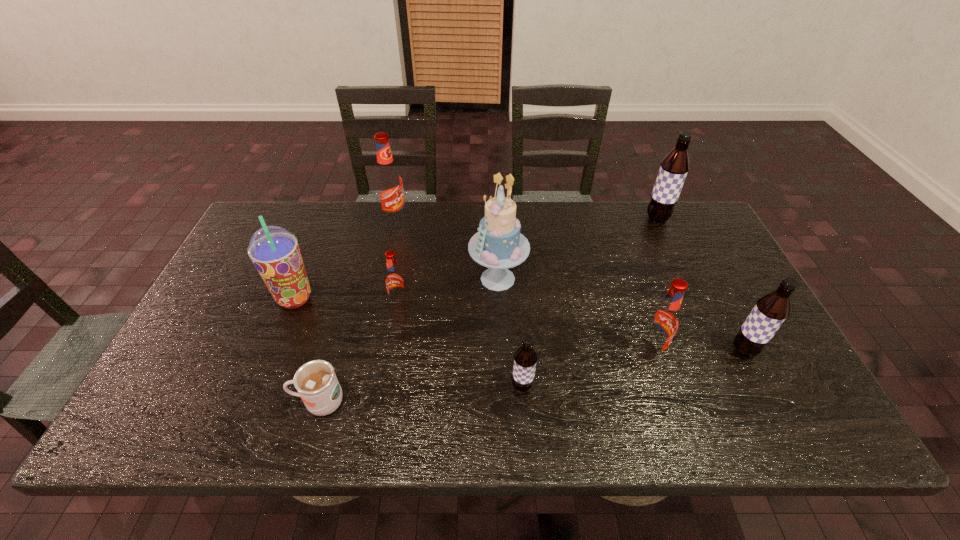
Image resolution: width=960 pixels, height=540 pixels. In order to click on free location located 0.150m on the right of the second farthest red root beer in this screenshot , I will do `click(464, 302)`.

I want to click on vacant space located 0.230m on the back of the nearest brown root beer, so click(x=516, y=304).

The image size is (960, 540). I want to click on vacant space situated 0.050m on the side with the handle of the cup, so click(x=269, y=402).

You are a GUI agent. You are given a task and a screenshot of the screen. Output one action in this format:
    pyautogui.click(x=<x>, y=<y>)
    Task: Click on the vacant space situated on the side with the handle of the cup
    This screenshot has width=960, height=540.
    Given the screenshot: What is the action you would take?
    pyautogui.click(x=265, y=402)

Locate an element on the screen. free spot located 0.210m on the side with the handle of the cup is located at coordinates (197, 402).

Find the location of a particular element. object located at the near edge is located at coordinates (316, 382).

You are a GUI agent. You are given a task and a screenshot of the screen. Output one action in this format:
    pyautogui.click(x=<x>, y=<y>)
    Task: Click on the object that is at the far right corner
    This screenshot has width=960, height=540.
    Given the screenshot: What is the action you would take?
    point(674,168)

Locate an element on the screen. blank area at the far edge is located at coordinates (545, 210).

This screenshot has height=540, width=960. I want to click on vacant space at the near edge of the desktop, so click(641, 426).

At what (x,y) coordinates should I click in order to perform the action: click on free space at the left edge. Please return your answer as a coordinate pair (x, y). This screenshot has height=540, width=960. Looking at the image, I should click on (224, 277).